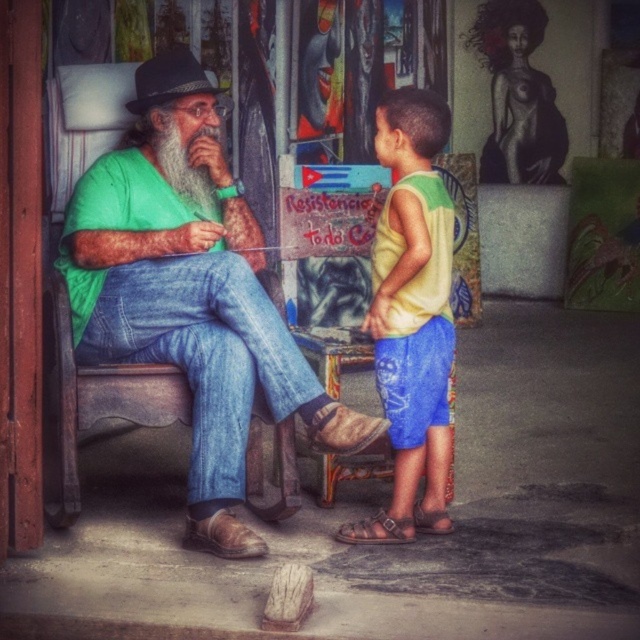
Question: Can you confirm if green matte shirt at left is wider than graywoollybeard at left?

Choices:
 (A) yes
 (B) no

Answer: (A)

Question: Which point is farther from the camera taking this photo?

Choices:
 (A) (168, 172)
 (B) (173, 301)

Answer: (A)

Question: Which of these objects is positioned farthest from the green matte shirt at left?

Choices:
 (A) yellow-green tank top at center
 (B) graywoollybeard at left

Answer: (A)

Question: Which of these objects is positioned closest to the graywoollybeard at left?

Choices:
 (A) green matte shirt at left
 (B) yellow-green tank top at center

Answer: (A)

Question: Is green matte shirt at left further to camera compared to yellow-green tank top at center?

Choices:
 (A) no
 (B) yes

Answer: (A)

Question: Considering the relative positions of green matte shirt at left and graywoollybeard at left in the image provided, where is green matte shirt at left located with respect to graywoollybeard at left?

Choices:
 (A) above
 (B) below

Answer: (B)